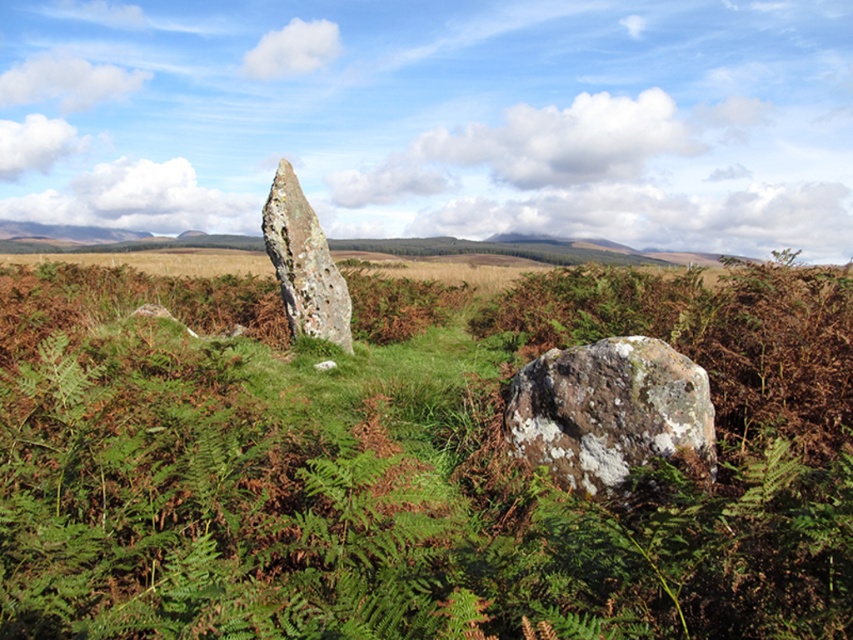
You are standing in the landscape and want to place a small garden ornament between the speckled rock at center and the speckled stone monolith at center. Which object should you position the ornament closer to if you want it to be on the right side of the monolith?

The speckled rock at center is to the right of the speckled stone monolith at center, so positioning the ornament closer to the speckled rock at center would place it on the right side of the monolith.

You are standing at the center of the image and want to place a small marker exactly at the position of the speckled rock at center. According to the coordinates provided, what are the exact coordinates where you should place the marker?

The speckled rock at center is located at point (x=610, y=412), so you should place the marker at those exact coordinates.

You are a geologist examining the speckled rock at center and the speckled stone monolith at center in the image. Which object is larger?

The speckled stone monolith at center is larger than the speckled rock at center.